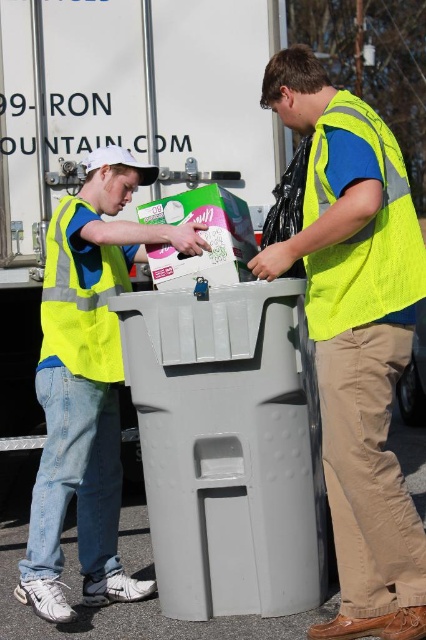
You are a delivery person who needs to place a package into the gray plastic recycling bin at center. However, there is a neon yellow mesh safety vest at right in the way. Can you still access the bin without moving the vest?

The gray plastic recycling bin at center is below the neon yellow mesh safety vest at right, so the vest is positioned higher up and not blocking the bin. Therefore, you can access the bin without moving the vest.

You are a safety inspector checking the placement of safety vests in a recycling area. You see the neon yellow vest at center and the neon yellow mesh safety vest at right. According to safety protocols, which vest should be moved to ensure proper positioning?

The neon yellow mesh safety vest at right should be moved to the left of the neon yellow vest at center to align with the safety protocol requirement that the vest on the right must be positioned to the left of the other.

You need to place a large cardboard box that is 1 meter wide into the gray plastic recycling bin at center. The neon yellow mesh safety vest at right is currently blocking access to the bin. Can the cardboard box fit into the bin if you move the vest out of the way?

The gray plastic recycling bin at center has a width larger than the neon yellow mesh safety vest at right. Since the cardboard box is 1 meter wide, moving the vest out of the way would allow the box to fit into the bin as the bin is wider than the vest.